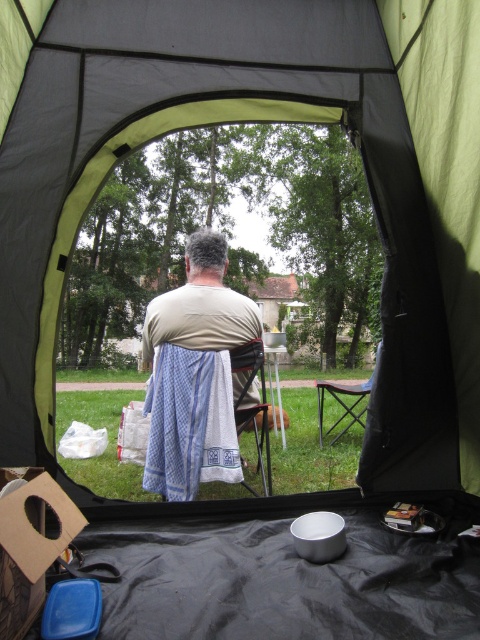
Can you confirm if blue checkered apron at center is positioned above wooden folding chair at center?

Yes, blue checkered apron at center is above wooden folding chair at center.

Is blue checkered apron at center further to camera compared to wooden folding chair at center?

Yes, it is.

At what (x,y) coordinates should I click in order to perform the action: click on blue checkered apron at center. Please return your answer as a coordinate pair (x, y). The width and height of the screenshot is (480, 640). Looking at the image, I should click on (200, 312).